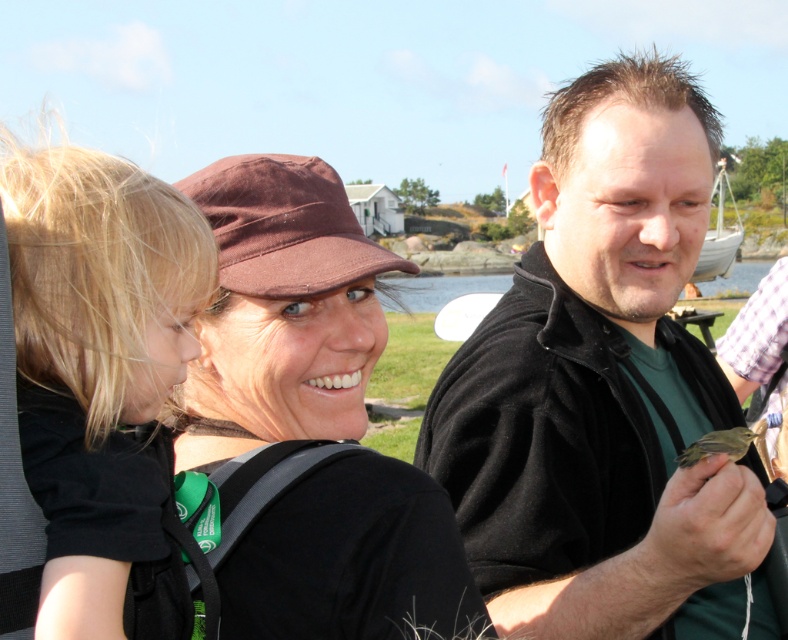
You are a photographer trying to capture the woman in the black softshell jacket at center and the child with blonde hair at left. Since the child is partially hidden, can you adjust your position to see the entire child without moving them? Explain using the scene details.

The blonde hair at left is behind the black softshell jacket at center, so moving to the side of the jacket might allow you to see the child fully by shifting your angle to avoid the obstruction.

You are a photographer trying to capture a group photo of the blonde hair at left and the brown feathered bird at center. The camera can only focus on objects wider than 10 cm. Can both subjects be in focus?

The blonde hair at left is wider than the brown feathered bird at center. However, since the exact width of the blonde hair at left is not provided, it is impossible to determine if both subjects meet the camera focus requirement of being wider than 10 cm.

You are standing in the scene and want to place a small flag at the closest point between point (725, 497) and point (731, 438). Which point should you choose?

Point (725, 497) is closer to the viewer than point (731, 438), so you should place the flag at point (725, 497).